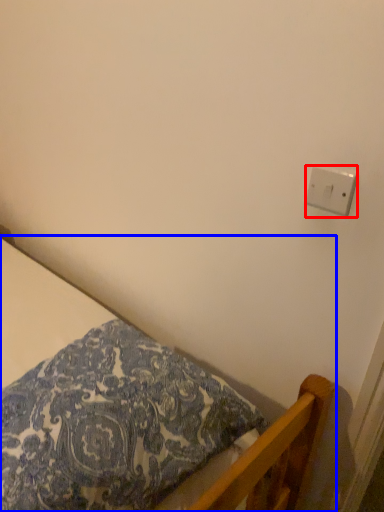
Question: Among these objects, which one is nearest to the camera, light switch (highlighted by a red box) or bed (highlighted by a blue box)?

Choices:
 (A) light switch
 (B) bed

Answer: (B)